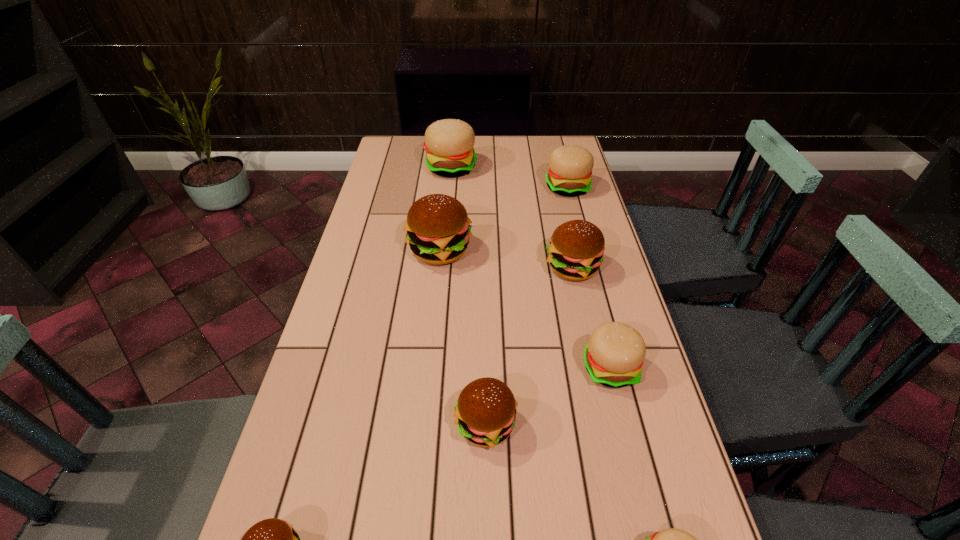
I want to click on vacant space located on the back of the rightmost brown hamburger, so (562, 217).

At what (x,y) coordinates should I click in order to perform the action: click on free spot located 0.190m on the back of the second biggest beige hamburger. Please return your answer as a coordinate pair (x, y). The height and width of the screenshot is (540, 960). Looking at the image, I should click on (558, 150).

Locate an element on the screen. The width and height of the screenshot is (960, 540). vacant position located 0.300m on the left of the third farthest brown hamburger is located at coordinates (311, 424).

You are a GUI agent. You are given a task and a screenshot of the screen. Output one action in this format:
    pyautogui.click(x=<x>, y=<y>)
    Task: Click on the vacant region located 0.180m on the front of the second smallest beige hamburger
    
    Given the screenshot: What is the action you would take?
    pyautogui.click(x=636, y=475)

Find the location of `object at the far edge`. object at the far edge is located at coordinates (449, 143).

Find the location of a particular element. This screenshot has height=540, width=960. vacant space at the left edge of the desktop is located at coordinates (403, 238).

What are the coordinates of `vacant region at the right edge of the desktop` in the screenshot? It's located at point(606,290).

This screenshot has width=960, height=540. Identify the location of vacant area at the far left corner of the desktop. (401, 155).

Locate an element on the screen. This screenshot has height=540, width=960. vacant area that lies between the third smallest beige hamburger and the third nearest object is located at coordinates (526, 306).

Where is `empty space between the second biggest beige hamburger and the leftmost beige hamburger`? The image size is (960, 540). empty space between the second biggest beige hamburger and the leftmost beige hamburger is located at coordinates (509, 178).